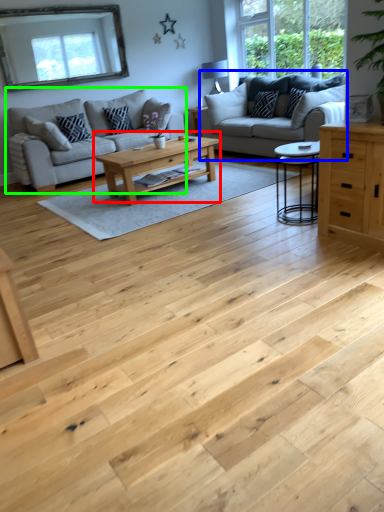
Question: Which object is positioned farthest from coffee table (highlighted by a red box)? Select from studio couch (highlighted by a blue box) and studio couch (highlighted by a green box).

Choices:
 (A) studio couch
 (B) studio couch

Answer: (B)